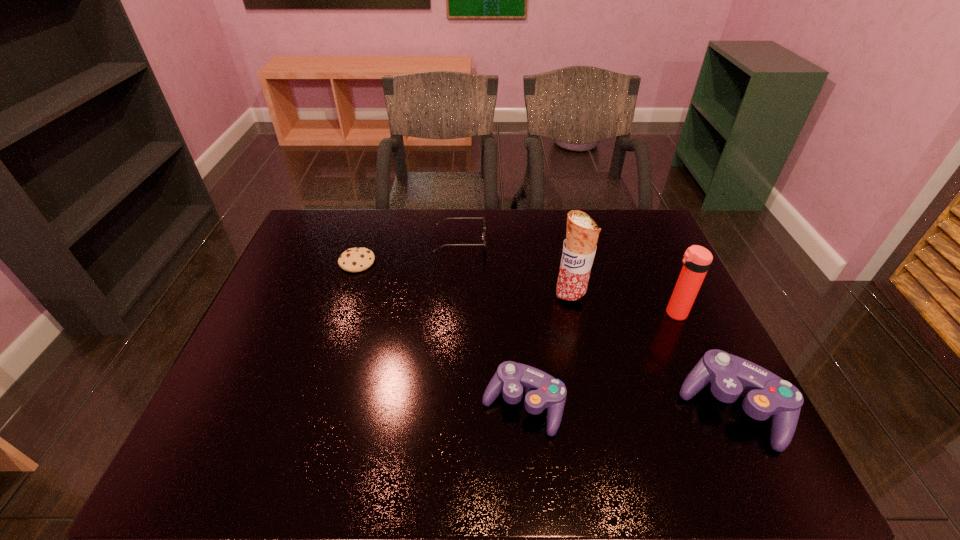
Locate an element on the screen. The height and width of the screenshot is (540, 960). vacant space located on the left of the left control is located at coordinates (412, 405).

Find the location of a particular element. vacant position located 0.290m on the back of the fourth shortest object is located at coordinates [x=675, y=287].

I want to click on free region located through the lenses of the spectacles, so click(x=514, y=242).

What are the coordinates of `vacant space located 0.050m on the left of the leftmost object` in the screenshot? It's located at (324, 262).

At what (x,y) coordinates should I click in order to perform the action: click on vacant space located on the right of the third object from right to left. Please return your answer as a coordinate pair (x, y). The image size is (960, 540). Looking at the image, I should click on (631, 296).

This screenshot has height=540, width=960. In order to click on free region located 0.090m on the front of the second tallest object in this screenshot , I will do coord(690,347).

I want to click on spectacles that is positioned at the far edge, so click(x=483, y=234).

At what (x,y) coordinates should I click in order to perform the action: click on cookie situated at the far edge. Please return your answer as a coordinate pair (x, y). This screenshot has width=960, height=540. Looking at the image, I should click on (358, 259).

Locate an element on the screen. This screenshot has height=540, width=960. control that is positioned at the right edge is located at coordinates (765, 394).

Locate an element on the screen. thermos bottle located at the right edge is located at coordinates (696, 261).